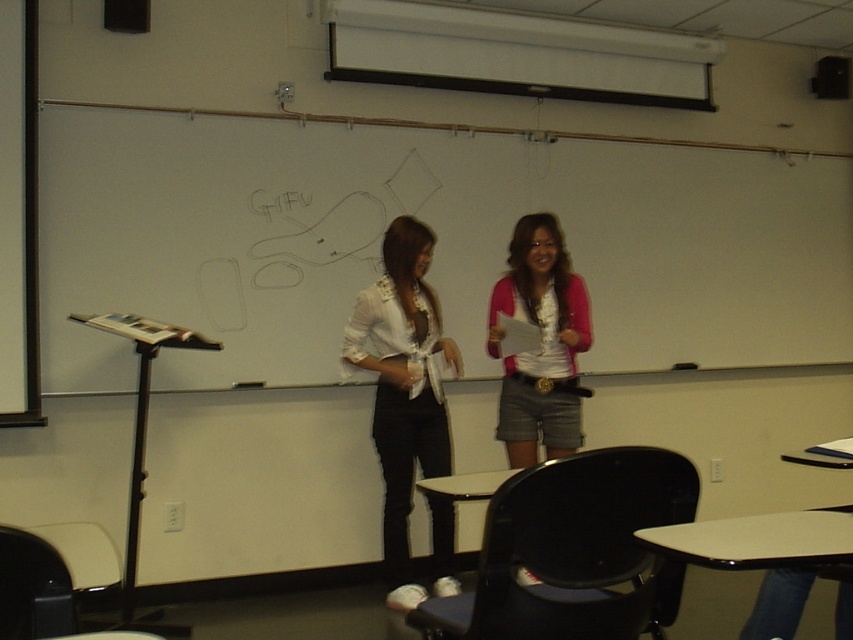
Question: Considering the relative positions of white matte whiteboard at center and white satin blouse at center in the image provided, where is white matte whiteboard at center located with respect to white satin blouse at center?

Choices:
 (A) right
 (B) left

Answer: (A)

Question: Which point is closer to the camera?

Choices:
 (A) (556, 252)
 (B) (436, 400)

Answer: (B)

Question: Can you confirm if white satin blouse at center is positioned to the left of pink fabric shirt at center?

Choices:
 (A) no
 (B) yes

Answer: (B)

Question: Based on their relative distances, which object is nearer to the pink fabric shirt at center?

Choices:
 (A) white satin blouse at center
 (B) white matte whiteboard at center

Answer: (A)

Question: Which object is farther from the camera taking this photo?

Choices:
 (A) white matte whiteboard at center
 (B) white satin blouse at center

Answer: (A)

Question: Is white matte whiteboard at center below white satin blouse at center?

Choices:
 (A) no
 (B) yes

Answer: (A)